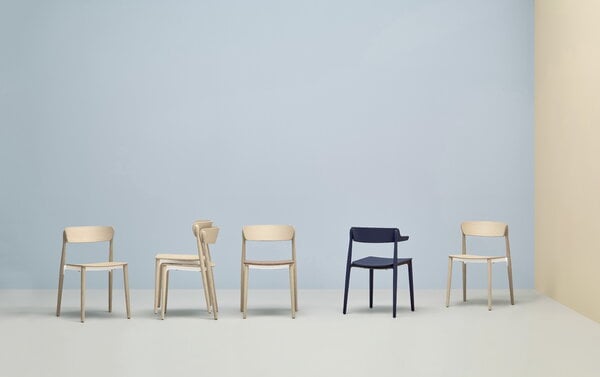
The image size is (600, 377). I want to click on black chair, so click(388, 236).